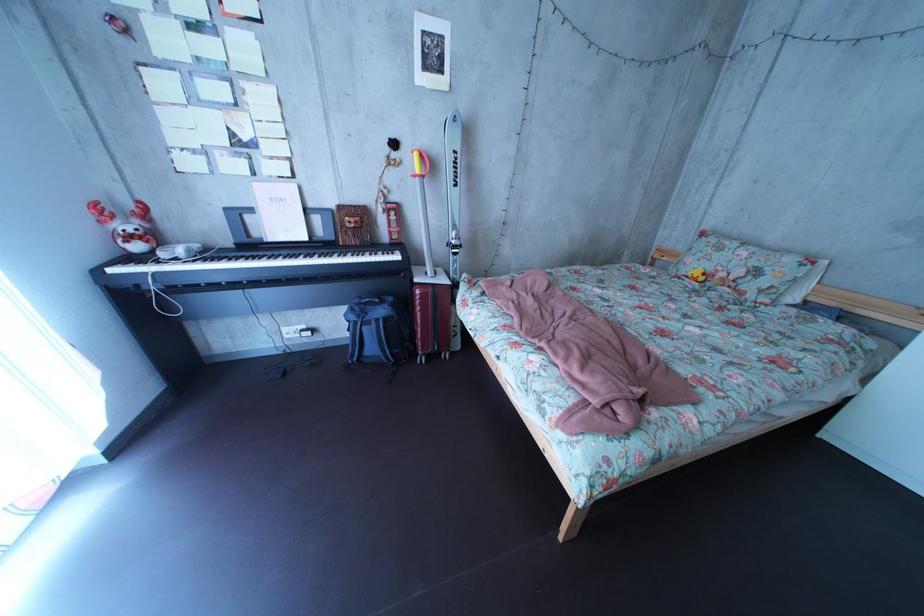
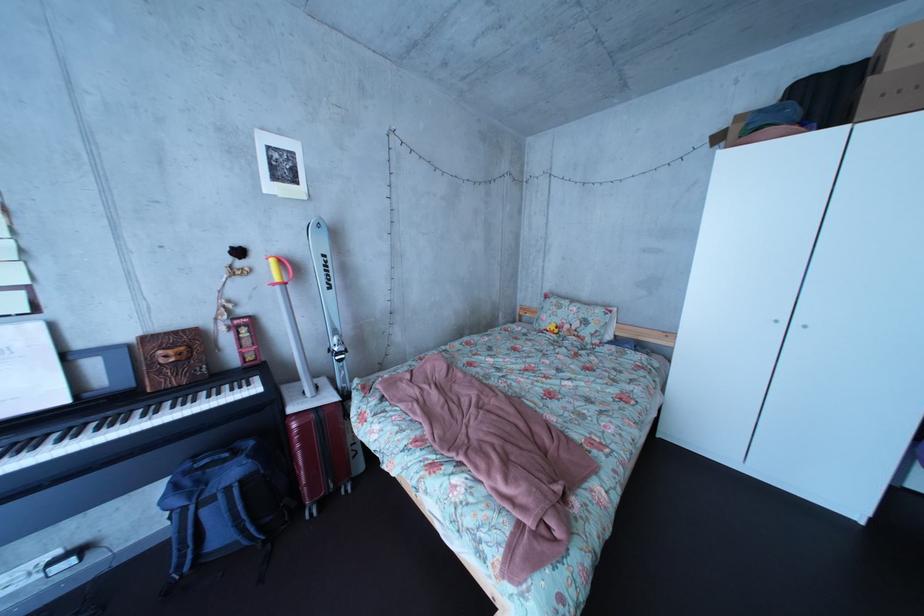
Question: The camera is either moving clockwise (left) or counter-clockwise (right) around the object. The first image is from the beginning of the video and the second image is from the end. Is the camera moving left or right when shooting the video?

Choices:
 (A) Left
 (B) Right

Answer: (A)